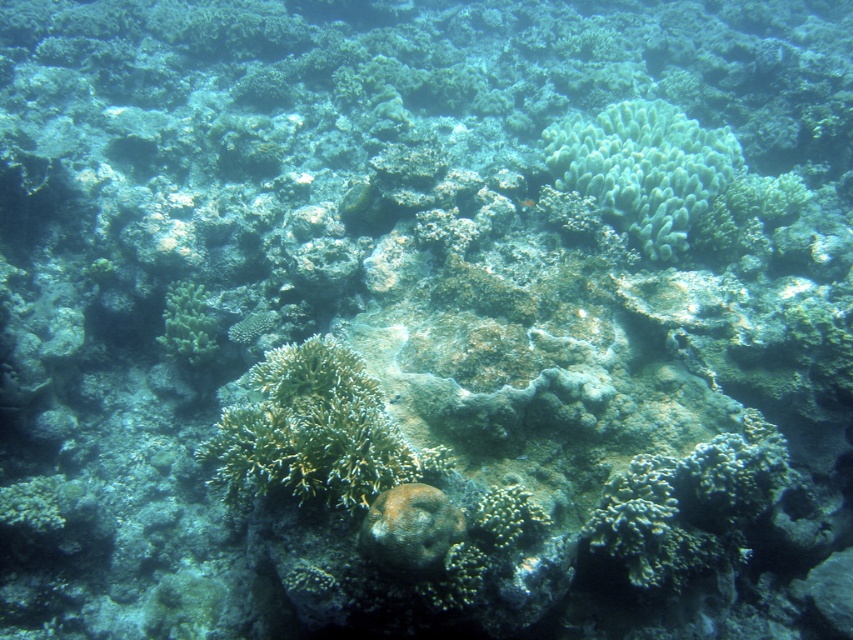
Question: Which of the following is the farthest from the observer?

Choices:
 (A) green textured coral at center
 (B) green soft coral at upper center
 (C) shiny orange fish at center

Answer: (B)

Question: Can you confirm if green matte coral at lower left is positioned below shiny orange fish at center?

Choices:
 (A) yes
 (B) no

Answer: (A)

Question: Which point is closer to the camera?

Choices:
 (A) (672, 234)
 (B) (228, 417)
 (C) (189, 362)

Answer: (B)

Question: Among these objects, which one is nearest to the camera?

Choices:
 (A) green matte coral at lower left
 (B) shiny orange fish at center
 (C) green textured coral at center
 (D) green soft coral at upper center

Answer: (C)

Question: Is green textured coral at center to the left of shiny orange fish at center from the viewer's perspective?

Choices:
 (A) no
 (B) yes

Answer: (B)

Question: Can you confirm if green textured coral at center is thinner than green matte coral at lower left?

Choices:
 (A) yes
 (B) no

Answer: (B)